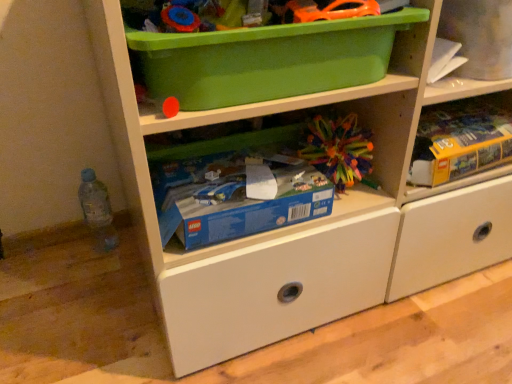
Image resolution: width=512 pixels, height=384 pixels. I want to click on vacant space situated on the left part of orange plastic toy car at upper center, the first toy viewed from the front, so click(224, 19).